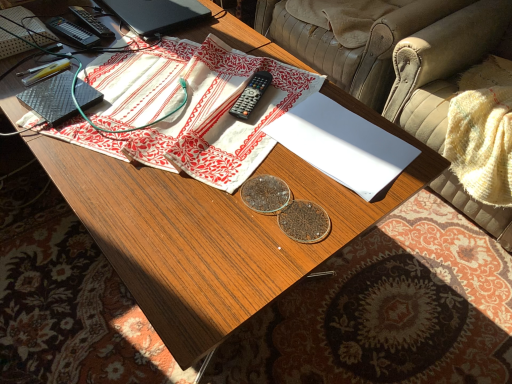
The image size is (512, 384). What are the coordinates of `free spot to the right of black plastic remote at center` in the screenshot? It's located at (302, 96).